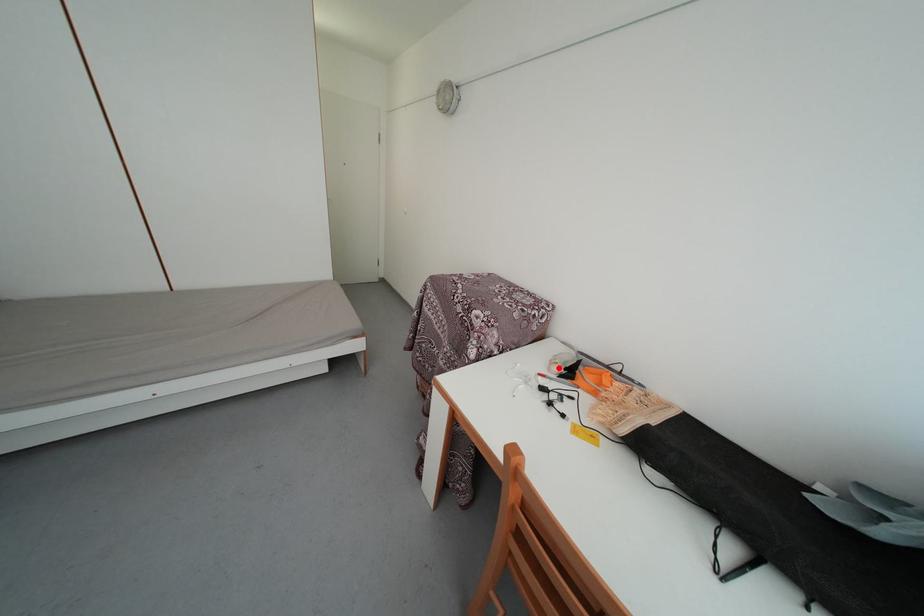
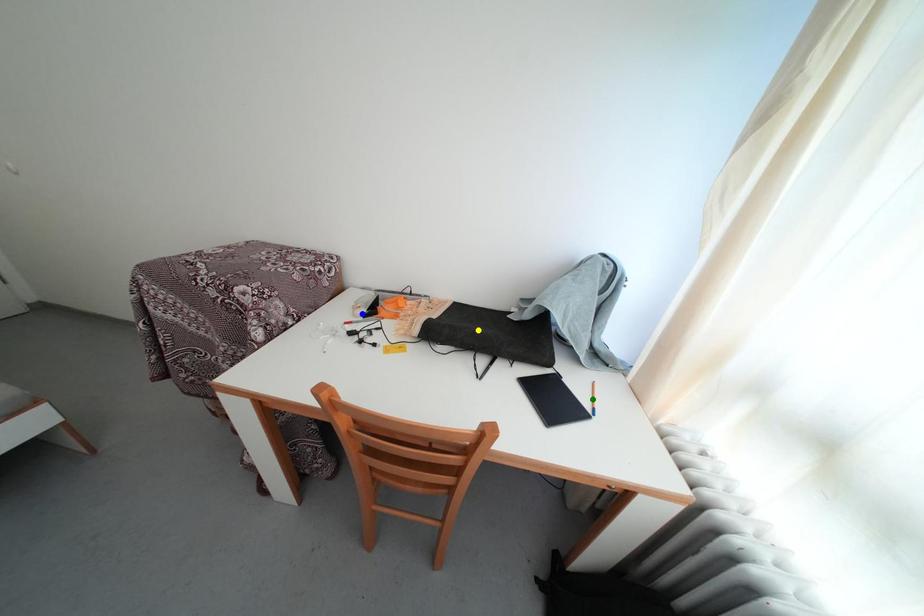
Question: I am providing you with two images of the same scene from different viewpoints. A red point is marked on the first image. You are given multiple points on the second image. Can you choose the point in image 2 that corresponds to the point in image 1?

Choices:
 (A) green point
 (B) blue point
 (C) yellow point

Answer: (B)